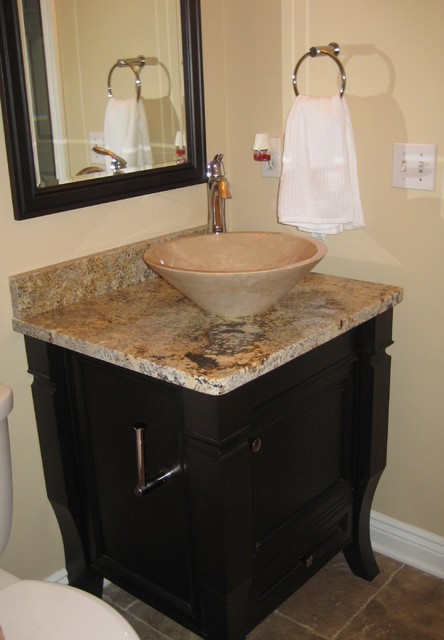
The image size is (444, 640). I want to click on marble, so click(x=123, y=356).